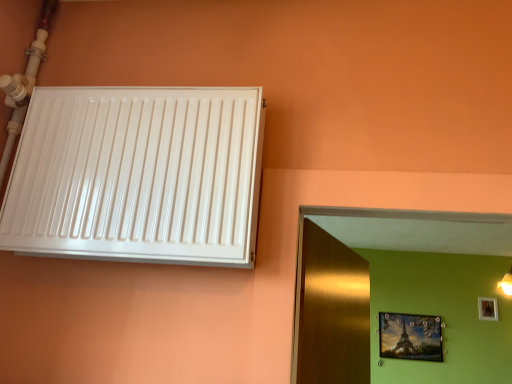
Measure the distance between metallic gold picture frame at upper right, the second picture frame positioned from the right, and camera.

The distance of metallic gold picture frame at upper right, the second picture frame positioned from the right, from camera is 7.95 feet.

This screenshot has width=512, height=384. I want to click on wooden photo frame at upper right, placed as the first picture frame when sorted from top to bottom, so point(488,308).

Considering the relative sizes of white glossy radiator at upper left and metallic gold picture frame at upper right, the 1th picture frame in the left-to-right sequence, in the image provided, is white glossy radiator at upper left taller than metallic gold picture frame at upper right, the 1th picture frame in the left-to-right sequence,?

No.

Which is less distant, [35,144] or [410,343]?

Point [35,144]

Locate an element on the screen. picture frame that is under the white glossy radiator at upper left (from a real-world perspective) is located at coordinates (410, 337).

From a real-world perspective, which is physically above, white glossy radiator at upper left or metallic gold picture frame at upper right, the second picture frame positioned from the right?

white glossy radiator at upper left.

Is wooden photo frame at upper right, the 2th picture frame from the bottom, bigger than metallic gold picture frame at upper right, the 1th picture frame in the left-to-right sequence?

Incorrect, wooden photo frame at upper right, the 2th picture frame from the bottom, is not larger than metallic gold picture frame at upper right, the 1th picture frame in the left-to-right sequence.

Is wooden photo frame at upper right, which is the 1th picture frame from right to left, far from metallic gold picture frame at upper right, arranged as the first picture frame when ordered from the bottom?

No, wooden photo frame at upper right, which is the 1th picture frame from right to left, is not far from metallic gold picture frame at upper right, arranged as the first picture frame when ordered from the bottom.

Locate an element on the screen. This screenshot has width=512, height=384. picture frame on the right side of metallic gold picture frame at upper right, the 1th picture frame in the left-to-right sequence is located at coordinates (488, 308).

Identify the location of picture frame in front of the wooden photo frame at upper right, which is the 1th picture frame from right to left. (410, 337).

Who is taller, metallic gold picture frame at upper right, the second picture frame from the top, or wooden photo frame at upper right, which is the 1th picture frame from right to left?

metallic gold picture frame at upper right, the second picture frame from the top.

From the image's perspective, between metallic gold picture frame at upper right, arranged as the first picture frame when ordered from the bottom, and wooden photo frame at upper right, placed as the first picture frame when sorted from top to bottom, who is located below?

metallic gold picture frame at upper right, arranged as the first picture frame when ordered from the bottom, is shown below in the image.

In the scene shown: Which point is more distant from viewer, (435, 348) or (489, 316)?

The point (489, 316) is farther.

Looking at this image, how different are the orientations of white glossy radiator at upper left and wooden photo frame at upper right, positioned as the second picture frame in left-to-right order, in degrees?

2.27 degrees.

Is white glossy radiator at upper left in front of or behind wooden photo frame at upper right, which is the 1th picture frame from right to left, in the image?

white glossy radiator at upper left is in front of wooden photo frame at upper right, which is the 1th picture frame from right to left.

Considering the sizes of objects white glossy radiator at upper left and wooden photo frame at upper right, the 2th picture frame from the bottom, in the image provided, who is taller, white glossy radiator at upper left or wooden photo frame at upper right, the 2th picture frame from the bottom,?

Standing taller between the two is white glossy radiator at upper left.

Is white glossy radiator at upper left at the back of metallic gold picture frame at upper right, the second picture frame positioned from the right?

No, white glossy radiator at upper left is not at the back of metallic gold picture frame at upper right, the second picture frame positioned from the right.

From the image's perspective, is metallic gold picture frame at upper right, the second picture frame positioned from the right, located above or below white glossy radiator at upper left?

Based on their image positions, metallic gold picture frame at upper right, the second picture frame positioned from the right, is located beneath white glossy radiator at upper left.

Is metallic gold picture frame at upper right, the 1th picture frame in the left-to-right sequence, to the right of white glossy radiator at upper left from the viewer's perspective?

Correct, you'll find metallic gold picture frame at upper right, the 1th picture frame in the left-to-right sequence, to the right of white glossy radiator at upper left.

Can you confirm if wooden photo frame at upper right, placed as the first picture frame when sorted from top to bottom, is positioned to the right of white glossy radiator at upper left?

Correct, you'll find wooden photo frame at upper right, placed as the first picture frame when sorted from top to bottom, to the right of white glossy radiator at upper left.

Looking at the image, does wooden photo frame at upper right, positioned as the second picture frame in left-to-right order, seem bigger or smaller compared to white glossy radiator at upper left?

Clearly, wooden photo frame at upper right, positioned as the second picture frame in left-to-right order, is smaller in size than white glossy radiator at upper left.

Considering the points (490, 300) and (74, 137), which point is in front, point (490, 300) or point (74, 137)?

Point (74, 137)

Is wooden photo frame at upper right, placed as the first picture frame when sorted from top to bottom, turned away from white glossy radiator at upper left?

wooden photo frame at upper right, placed as the first picture frame when sorted from top to bottom, is not turned away from white glossy radiator at upper left.

Where is `picture frame located underneath the white glossy radiator at upper left (from a real-world perspective)`? picture frame located underneath the white glossy radiator at upper left (from a real-world perspective) is located at coordinates (410, 337).

At what (x,y) coordinates should I click in order to perform the action: click on picture frame behind the metallic gold picture frame at upper right, the 1th picture frame in the left-to-right sequence. Please return your answer as a coordinate pair (x, y). The width and height of the screenshot is (512, 384). Looking at the image, I should click on (488, 308).

Based on their spatial positions, is wooden photo frame at upper right, the 2th picture frame from the bottom, or metallic gold picture frame at upper right, the second picture frame positioned from the right, closer to white glossy radiator at upper left?

Based on the image, metallic gold picture frame at upper right, the second picture frame positioned from the right, appears to be nearer to white glossy radiator at upper left.

Which object lies nearer to the anchor point wooden photo frame at upper right, which is the 1th picture frame from right to left, metallic gold picture frame at upper right, the second picture frame positioned from the right, or white glossy radiator at upper left?

Among the two, metallic gold picture frame at upper right, the second picture frame positioned from the right, is located nearer to wooden photo frame at upper right, which is the 1th picture frame from right to left.

Based on their spatial positions, is white glossy radiator at upper left or wooden photo frame at upper right, placed as the first picture frame when sorted from top to bottom, closer to metallic gold picture frame at upper right, arranged as the first picture frame when ordered from the bottom?

wooden photo frame at upper right, placed as the first picture frame when sorted from top to bottom, lies closer to metallic gold picture frame at upper right, arranged as the first picture frame when ordered from the bottom, than the other object.

Estimate the real-world distances between objects in this image. Which object is further from metallic gold picture frame at upper right, the second picture frame from the top, wooden photo frame at upper right, the 2th picture frame from the bottom, or white glossy radiator at upper left?

The object further to metallic gold picture frame at upper right, the second picture frame from the top, is white glossy radiator at upper left.

Considering their positions, is metallic gold picture frame at upper right, the second picture frame positioned from the right, positioned further to white glossy radiator at upper left than wooden photo frame at upper right, placed as the first picture frame when sorted from top to bottom?

wooden photo frame at upper right, placed as the first picture frame when sorted from top to bottom, is positioned further to the anchor white glossy radiator at upper left.

Based on their spatial positions, is white glossy radiator at upper left or metallic gold picture frame at upper right, arranged as the first picture frame when ordered from the bottom, further from wooden photo frame at upper right, placed as the first picture frame when sorted from top to bottom?

white glossy radiator at upper left.

Where is `picture frame positioned between white glossy radiator at upper left and wooden photo frame at upper right, positioned as the second picture frame in left-to-right order, from near to far`? The image size is (512, 384). picture frame positioned between white glossy radiator at upper left and wooden photo frame at upper right, positioned as the second picture frame in left-to-right order, from near to far is located at coordinates (410, 337).